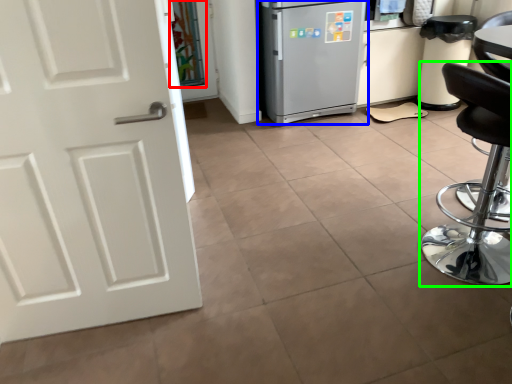
Question: Estimate the real-world distances between objects in this image. Which object is closer to glass door (highlighted by a red box), refrigerator (highlighted by a blue box) or chair (highlighted by a green box)?

Choices:
 (A) refrigerator
 (B) chair

Answer: (A)